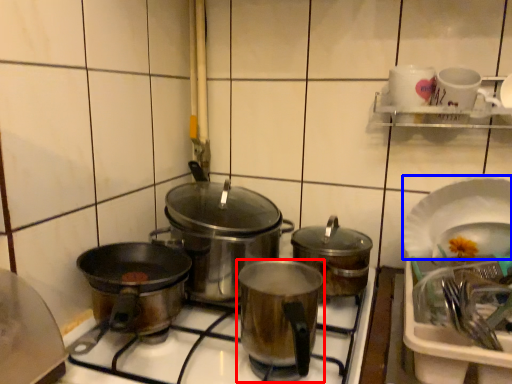
Question: Which object appears closest to the camera in this image, kitchen appliance (highlighted by a red box) or platter (highlighted by a blue box)?

Choices:
 (A) kitchen appliance
 (B) platter

Answer: (A)